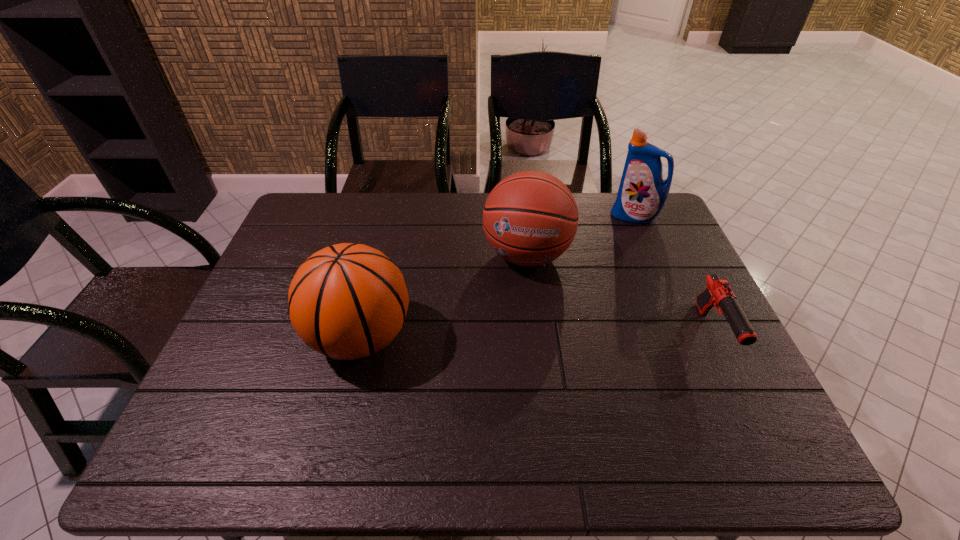
In the image, there is a desktop. Identify the location of free space at the far edge. (452, 221).

In the image, there is a desktop. Identify the location of vacant space at the near edge. The image size is (960, 540). (562, 403).

Locate an element on the screen. This screenshot has height=540, width=960. vacant space at the left edge of the desktop is located at coordinates (324, 246).

In the image, there is a desktop. Where is `free space at the right edge`? This screenshot has width=960, height=540. free space at the right edge is located at coordinates (657, 320).

You are a GUI agent. You are given a task and a screenshot of the screen. Output one action in this format:
    pyautogui.click(x=<x>, y=<y>)
    Task: Click on the vacant space at the far left corner of the desktop
    
    Given the screenshot: What is the action you would take?
    pyautogui.click(x=305, y=207)

In the image, there is a desktop. Where is `vacant space at the near left corner`? vacant space at the near left corner is located at coordinates (228, 411).

Identify the location of empty space that is in between the left basketball and the right basketball. (444, 296).

Locate an element on the screen. free point between the shortest object and the detergent is located at coordinates (674, 275).

This screenshot has width=960, height=540. I want to click on unoccupied area between the gun and the farther basketball, so click(x=620, y=294).

You are a GUI agent. You are given a task and a screenshot of the screen. Output one action in this format:
    pyautogui.click(x=<x>, y=<y>)
    Task: Click on the empty space that is in between the farthest object and the second farthest object
    
    Given the screenshot: What is the action you would take?
    pyautogui.click(x=581, y=235)